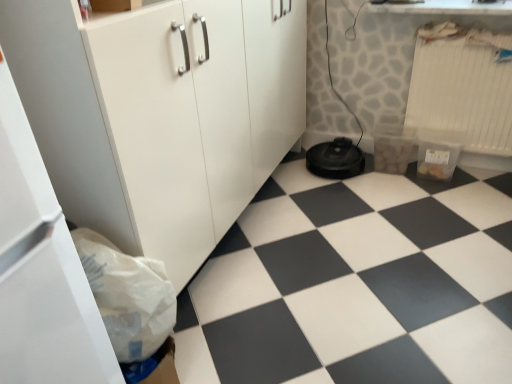
Question: Is white paper bag at lower left completely or partially inside black plastic robot vacuum cleaner at lower center?

Choices:
 (A) yes
 (B) no

Answer: (B)

Question: Does black plastic robot vacuum cleaner at lower center come behind white paper bag at lower left?

Choices:
 (A) no
 (B) yes

Answer: (B)

Question: Is black plastic robot vacuum cleaner at lower center turned away from white paper bag at lower left?

Choices:
 (A) yes
 (B) no

Answer: (B)

Question: Can you confirm if black plastic robot vacuum cleaner at lower center is taller than white paper bag at lower left?

Choices:
 (A) yes
 (B) no

Answer: (B)

Question: From the image's perspective, is black plastic robot vacuum cleaner at lower center located beneath white paper bag at lower left?

Choices:
 (A) yes
 (B) no

Answer: (B)

Question: Is black plastic robot vacuum cleaner at lower center closer to the viewer compared to white paper bag at lower left?

Choices:
 (A) yes
 (B) no

Answer: (B)

Question: Does black plastic robot vacuum cleaner at lower center have a smaller size compared to black rubber vacuum cleaner at lower center?

Choices:
 (A) no
 (B) yes

Answer: (B)

Question: Is black plastic robot vacuum cleaner at lower center oriented towards black rubber vacuum cleaner at lower center?

Choices:
 (A) no
 (B) yes

Answer: (B)

Question: Can you confirm if black plastic robot vacuum cleaner at lower center is taller than black rubber vacuum cleaner at lower center?

Choices:
 (A) yes
 (B) no

Answer: (A)

Question: Is black plastic robot vacuum cleaner at lower center thinner than black rubber vacuum cleaner at lower center?

Choices:
 (A) yes
 (B) no

Answer: (A)

Question: Considering the relative positions of black plastic robot vacuum cleaner at lower center and black rubber vacuum cleaner at lower center in the image provided, is black plastic robot vacuum cleaner at lower center to the left of black rubber vacuum cleaner at lower center from the viewer's perspective?

Choices:
 (A) no
 (B) yes

Answer: (B)

Question: Considering the relative positions of black plastic robot vacuum cleaner at lower center and black rubber vacuum cleaner at lower center in the image provided, is black plastic robot vacuum cleaner at lower center in front of black rubber vacuum cleaner at lower center?

Choices:
 (A) no
 (B) yes

Answer: (A)

Question: Is white plastic radiator at upper right surrounded by white matte cabinet at lower left?

Choices:
 (A) yes
 (B) no

Answer: (B)